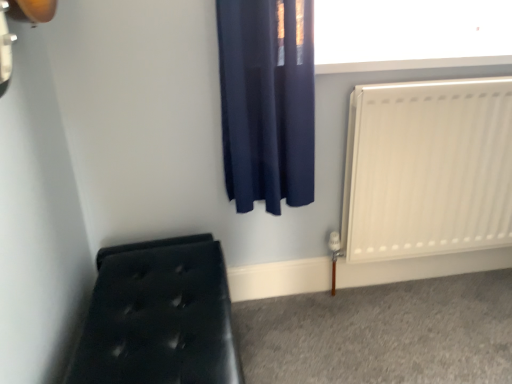
Identify the location of white smooth window sill at upper center. The height and width of the screenshot is (384, 512). (411, 64).

Describe the element at coordinates (267, 101) in the screenshot. The height and width of the screenshot is (384, 512). I see `dark blue fabric curtain at upper center` at that location.

You are a GUI agent. You are given a task and a screenshot of the screen. Output one action in this format:
    pyautogui.click(x=<x>, y=<y>)
    Task: Click on the white matte radiator at right
    This screenshot has height=384, width=512.
    Given the screenshot: What is the action you would take?
    pyautogui.click(x=428, y=169)

Locate an element on the screen. This screenshot has height=384, width=512. black tufted bench at lower left is located at coordinates (159, 316).

Is white matte radiator at right smaller than white smooth window sill at upper center?

Actually, white matte radiator at right might be larger than white smooth window sill at upper center.

Does point (349, 145) lie behind point (357, 62)?

Yes, point (349, 145) is behind point (357, 62).

Is white matte radiator at right wider or thinner than white smooth window sill at upper center?

In the image, white matte radiator at right appears to be more narrow than white smooth window sill at upper center.

Can you confirm if white matte radiator at right is positioned to the left of white smooth window sill at upper center?

No.

Can you tell me how much white matte radiator at right and dark blue fabric curtain at upper center differ in facing direction?

There is a 2.19-degree angle between the facing directions of white matte radiator at right and dark blue fabric curtain at upper center.

Which of these two, white matte radiator at right or dark blue fabric curtain at upper center, stands taller?

white matte radiator at right.

From the image's perspective, is white matte radiator at right located above or below dark blue fabric curtain at upper center?

white matte radiator at right is situated lower than dark blue fabric curtain at upper center in the image.

Consider the image. Is white matte radiator at right not close to dark blue fabric curtain at upper center?

white matte radiator at right is actually quite close to dark blue fabric curtain at upper center.

From a real-world perspective, which object stands above the other?

white smooth window sill at upper center.

Is white smooth window sill at upper center wider than black tufted bench at lower left?

No.

Which is in front, white smooth window sill at upper center or black tufted bench at lower left?

black tufted bench at lower left is closer to the camera.

Considering the sizes of objects white smooth window sill at upper center and black tufted bench at lower left in the image provided, who is bigger, white smooth window sill at upper center or black tufted bench at lower left?

With larger size is black tufted bench at lower left.

The height and width of the screenshot is (384, 512). What are the coordinates of `radiator located above the black tufted bench at lower left (from the image's perspective)` in the screenshot? It's located at (428, 169).

Would you consider black tufted bench at lower left to be distant from white matte radiator at right?

They are positioned close to each other.

Considering the relative positions of black tufted bench at lower left and white matte radiator at right in the image provided, is black tufted bench at lower left to the right of white matte radiator at right from the viewer's perspective?

In fact, black tufted bench at lower left is to the left of white matte radiator at right.

Is black tufted bench at lower left further to the viewer compared to white matte radiator at right?

No, black tufted bench at lower left is closer to the camera.

Is black tufted bench at lower left facing towards white smooth window sill at upper center?

No, black tufted bench at lower left is not oriented towards white smooth window sill at upper center.

Considering the relative sizes of black tufted bench at lower left and white smooth window sill at upper center in the image provided, is black tufted bench at lower left thinner than white smooth window sill at upper center?

Incorrect, the width of black tufted bench at lower left is not less than that of white smooth window sill at upper center.

Considering the positions of objects black tufted bench at lower left and white smooth window sill at upper center in the image provided, who is behind, black tufted bench at lower left or white smooth window sill at upper center?

white smooth window sill at upper center is more distant.

Looking at this image, is black tufted bench at lower left bigger or smaller than white smooth window sill at upper center?

Considering their sizes, black tufted bench at lower left takes up more space than white smooth window sill at upper center.

From a real-world perspective, is white matte radiator at right positioned above or below black tufted bench at lower left?

white matte radiator at right is situated higher than black tufted bench at lower left in the real world.

Is white matte radiator at right next to black tufted bench at lower left and touching it?

There is a gap between white matte radiator at right and black tufted bench at lower left.

Considering the relative sizes of white matte radiator at right and black tufted bench at lower left in the image provided, is white matte radiator at right bigger than black tufted bench at lower left?

Incorrect, white matte radiator at right is not larger than black tufted bench at lower left.

Is black tufted bench at lower left turned away from dark blue fabric curtain at upper center?

black tufted bench at lower left does not have its back to dark blue fabric curtain at upper center.

Is black tufted bench at lower left wider than dark blue fabric curtain at upper center?

Yes.

Consider the image. From the image's perspective, is black tufted bench at lower left above or below dark blue fabric curtain at upper center?

black tufted bench at lower left is situated lower than dark blue fabric curtain at upper center in the image.

Looking at this image, which is nearer, (x=204, y=322) or (x=281, y=106)?

Clearly, point (x=204, y=322) is closer to the camera than point (x=281, y=106).

At what (x,y) coordinates should I click in order to perform the action: click on window sill lying above the white matte radiator at right (from the image's perspective). Please return your answer as a coordinate pair (x, y). The image size is (512, 384). Looking at the image, I should click on (411, 64).

The height and width of the screenshot is (384, 512). Find the location of `curtain that appears on the left of white matte radiator at right`. curtain that appears on the left of white matte radiator at right is located at coordinates (267, 101).

Estimate the real-world distances between objects in this image. Which object is further from white matte radiator at right, black tufted bench at lower left or white smooth window sill at upper center?

Based on the image, black tufted bench at lower left appears to be further to white matte radiator at right.

Considering their positions, is white matte radiator at right positioned further to black tufted bench at lower left than dark blue fabric curtain at upper center?

Among the two, white matte radiator at right is located further to black tufted bench at lower left.

Which object lies further to the anchor point black tufted bench at lower left, white smooth window sill at upper center or dark blue fabric curtain at upper center?

white smooth window sill at upper center is further to black tufted bench at lower left.

Considering their positions, is dark blue fabric curtain at upper center positioned further to white smooth window sill at upper center than white matte radiator at right?

white matte radiator at right.

Estimate the real-world distances between objects in this image. Which object is further from dark blue fabric curtain at upper center, black tufted bench at lower left or white matte radiator at right?

black tufted bench at lower left.

Based on their spatial positions, is white smooth window sill at upper center or white matte radiator at right closer to black tufted bench at lower left?

Among the two, white matte radiator at right is located nearer to black tufted bench at lower left.

Considering their positions, is black tufted bench at lower left positioned closer to white matte radiator at right than dark blue fabric curtain at upper center?

dark blue fabric curtain at upper center is positioned closer to the anchor white matte radiator at right.

Based on their spatial positions, is white smooth window sill at upper center or dark blue fabric curtain at upper center closer to white matte radiator at right?

white smooth window sill at upper center lies closer to white matte radiator at right than the other object.

Where is `curtain between white smooth window sill at upper center and black tufted bench at lower left vertically`? The height and width of the screenshot is (384, 512). curtain between white smooth window sill at upper center and black tufted bench at lower left vertically is located at coordinates (267, 101).

Image resolution: width=512 pixels, height=384 pixels. Find the location of `window sill located between black tufted bench at lower left and white matte radiator at right in the left-right direction`. window sill located between black tufted bench at lower left and white matte radiator at right in the left-right direction is located at coordinates (411, 64).

Locate an element on the screen. curtain between black tufted bench at lower left and white matte radiator at right is located at coordinates (267, 101).

This screenshot has width=512, height=384. I want to click on window sill between dark blue fabric curtain at upper center and white matte radiator at right, so click(411, 64).